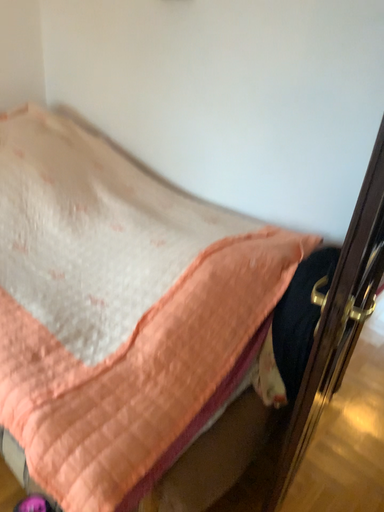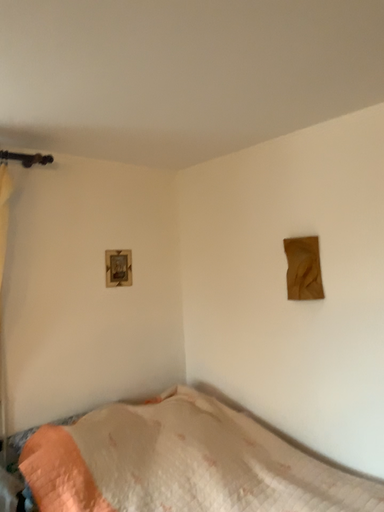
Question: How did the camera likely rotate when shooting the video?

Choices:
 (A) rotated left
 (B) rotated right

Answer: (A)